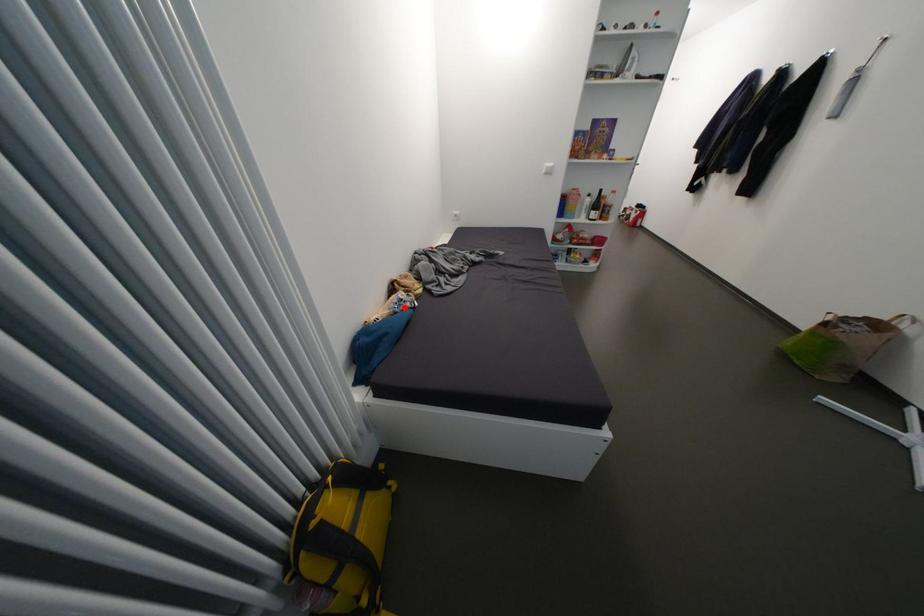
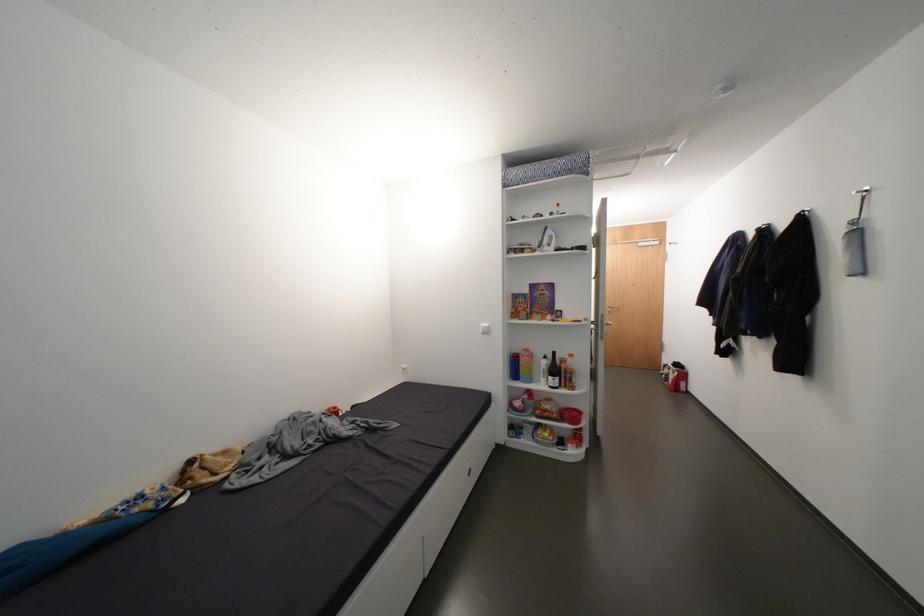
Question: I am providing you with two images of the same scene from different viewpoints. Image1 has a red point marked. In image2, the corresponding 3D location appears at what relative position? Reply with the corresponding letter.

Choices:
 (A) Closer
 (B) Farther

Answer: (B)